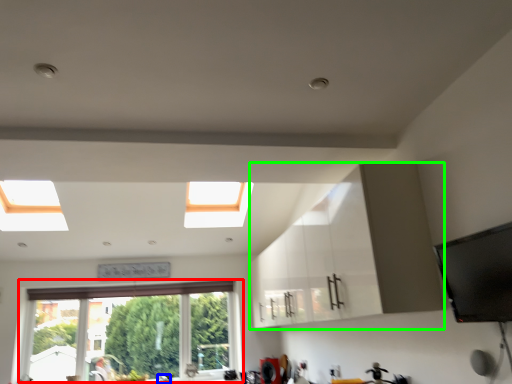
Question: Estimate the real-world distances between objects in this image. Which object is closer to window (highlighted by a red box), faucet (highlighted by a blue box) or cabinetry (highlighted by a green box)?

Choices:
 (A) faucet
 (B) cabinetry

Answer: (A)